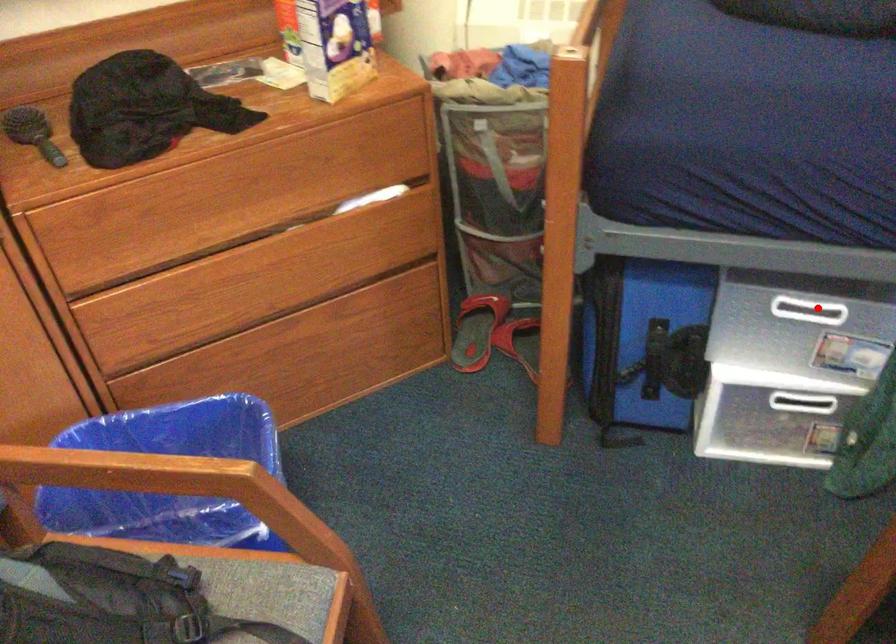
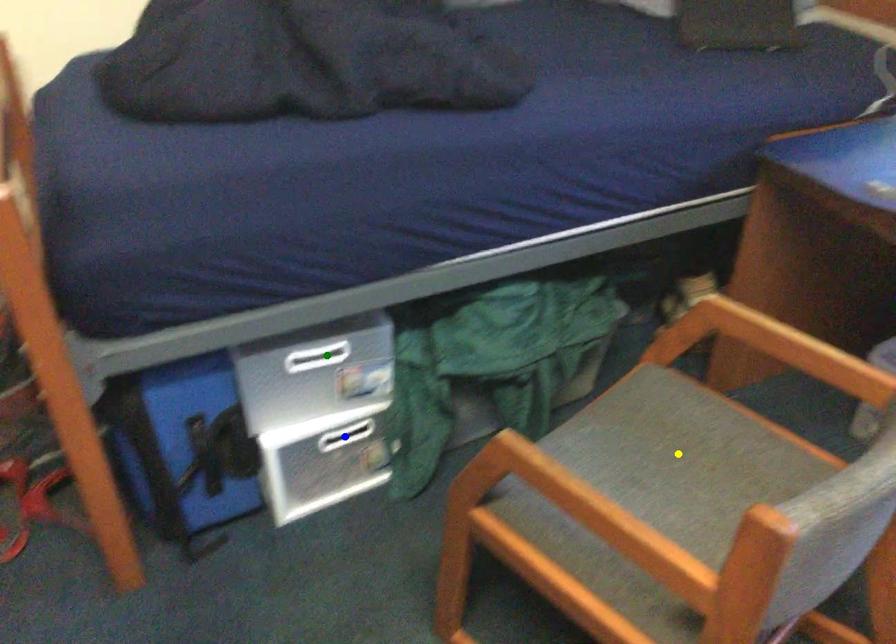
Question: I am providing you with two images of the same scene from different viewpoints. A red point is marked on the first image. You are given multiple points on the second image. Which spot in image 2 lines up with the point in image 1?

Choices:
 (A) blue point
 (B) yellow point
 (C) green point

Answer: (C)